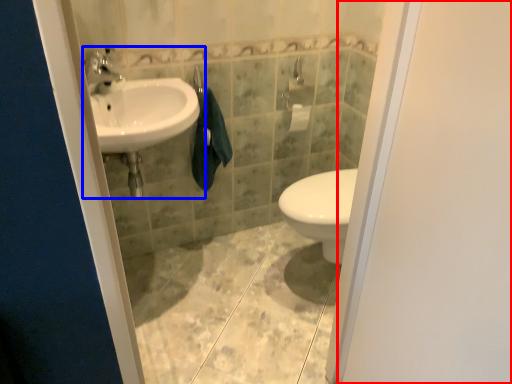
Question: Among these objects, which one is nearest to the camera, screen door (highlighted by a red box) or sink (highlighted by a blue box)?

Choices:
 (A) screen door
 (B) sink

Answer: (A)